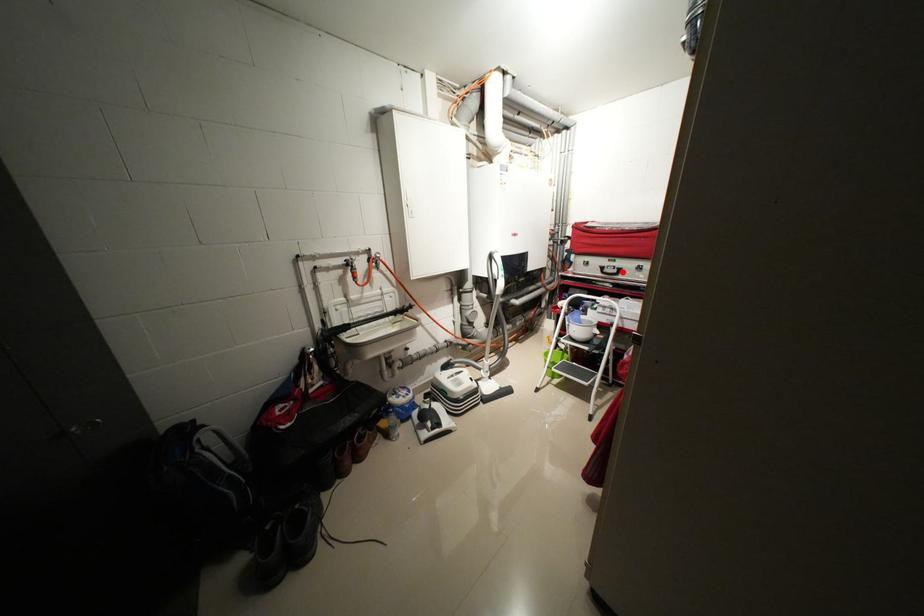
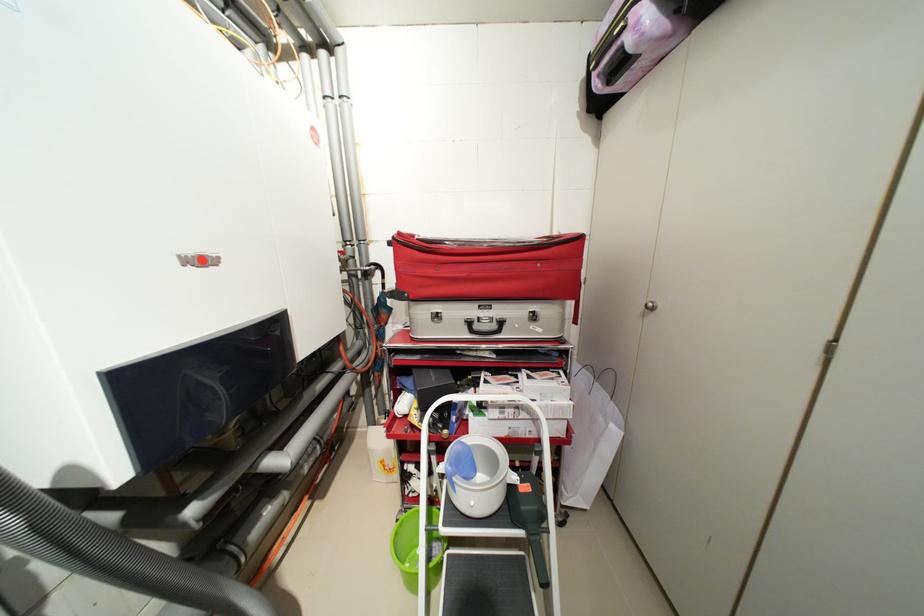
Where in the second image is the point corresponding to the highlighted location from the first image?

(502, 326)